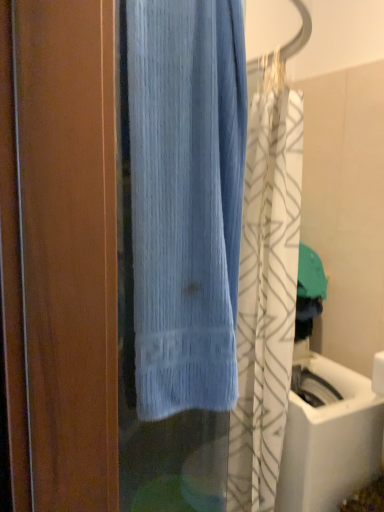
What is the approximate height of white glossy sink at lower right?

white glossy sink at lower right is 92.31 centimeters tall.

Measure the distance between point (184, 102) and camera.

The depth of point (184, 102) is 30.39 inches.

What is the approximate width of light blue textured towel at center?

The width of light blue textured towel at center is 9.54 inches.

What is the approximate height of light blue textured towel at center?

1.90 meters.

You are a GUI agent. You are given a task and a screenshot of the screen. Output one action in this format:
    pyautogui.click(x=<x>, y=<y>)
    Task: Click on the white glossy sink at lower right
    This screenshot has width=384, height=512.
    Given the screenshot: What is the action you would take?
    pyautogui.click(x=328, y=436)

Is light blue fabric at center inside the boundaries of white glossy sink at lower right, or outside?

light blue fabric at center is located beyond the bounds of white glossy sink at lower right.

Between light blue fabric at center and white glossy sink at lower right, which one has larger size?

white glossy sink at lower right is bigger.

How much distance is there between light blue fabric at center and white glossy sink at lower right?

light blue fabric at center and white glossy sink at lower right are 38.00 inches apart.

The width and height of the screenshot is (384, 512). What are the coordinates of `curtain in front of the white glossy sink at lower right` in the screenshot? It's located at (186, 199).

Which point is more forward, [336,394] or [184,258]?

Positioned in front is point [184,258].

Is the position of white glossy sink at lower right more distant than that of light blue fabric at center?

Yes, it is.

Does white glossy sink at lower right have a lesser width compared to light blue fabric at center?

No, white glossy sink at lower right is not thinner than light blue fabric at center.

What's the angular difference between white glossy sink at lower right and light blue fabric at center's facing directions?

white glossy sink at lower right and light blue fabric at center are facing 7.71 degrees away from each other.

Is light blue textured towel at center thinner than white glossy sink at lower right?

Yes.

Which is behind, point (270, 126) or point (321, 486)?

Point (321, 486)

Can we say light blue textured towel at center lies outside white glossy sink at lower right?

light blue textured towel at center is positioned outside white glossy sink at lower right.

Would you consider light blue textured towel at center to be distant from white glossy sink at lower right?

light blue textured towel at center is near white glossy sink at lower right, not far away.

Can you confirm if white glossy sink at lower right is thinner than light blue textured towel at center?

Incorrect, the width of white glossy sink at lower right is not less than that of light blue textured towel at center.

Is white glossy sink at lower right directly adjacent to light blue textured towel at center?

Answer: There is a gap between white glossy sink at lower right and light blue textured towel at center.

From a real-world perspective, is white glossy sink at lower right physically below light blue textured towel at center?

Yes, from a real-world perspective, white glossy sink at lower right is beneath light blue textured towel at center.

Who is smaller, white glossy sink at lower right or light blue textured towel at center?

white glossy sink at lower right.

Which is less distant, (x=268, y=294) or (x=164, y=383)?

The point (x=164, y=383) is closer.

From the image's perspective, which one is positioned higher, light blue textured towel at center or light blue fabric at center?

light blue fabric at center, from the image's perspective.

Locate an element on the screen. curtain that is above the light blue textured towel at center (from a real-world perspective) is located at coordinates (186, 199).

Can you confirm if light blue textured towel at center is positioned to the right of light blue fabric at center?

Indeed, light blue textured towel at center is positioned on the right side of light blue fabric at center.

Locate an element on the screen. shower curtain behind the light blue fabric at center is located at coordinates (266, 285).

Looking at this image, is light blue fabric at center taller or shorter than light blue textured towel at center?

In the image, light blue fabric at center appears to be shorter than light blue textured towel at center.

Is light blue fabric at center smaller than light blue textured towel at center?

Yes.

Identify the location of curtain above the white glossy sink at lower right (from a real-world perspective). The image size is (384, 512). (186, 199).

Locate an element on the screen. This screenshot has width=384, height=512. sink on the right of light blue fabric at center is located at coordinates (328, 436).

From the image, which object appears to be farther from white glossy sink at lower right, light blue textured towel at center or light blue fabric at center?

light blue fabric at center.

Estimate the real-world distances between objects in this image. Which object is further from light blue fabric at center, white glossy sink at lower right or light blue textured towel at center?

Based on the image, white glossy sink at lower right appears to be further to light blue fabric at center.

When comparing their distances from white glossy sink at lower right, does light blue fabric at center or light blue textured towel at center seem closer?

The object closer to white glossy sink at lower right is light blue textured towel at center.

Looking at the image, which one is located closer to light blue textured towel at center, white glossy sink at lower right or light blue fabric at center?

white glossy sink at lower right is closer to light blue textured towel at center.

Looking at the image, which one is located closer to light blue textured towel at center, light blue fabric at center or white glossy sink at lower right?

The object closer to light blue textured towel at center is white glossy sink at lower right.

Estimate the real-world distances between objects in this image. Which object is closer to light blue fabric at center, light blue textured towel at center or white glossy sink at lower right?

light blue textured towel at center is positioned closer to the anchor light blue fabric at center.

This screenshot has width=384, height=512. In order to click on shower curtain between light blue fabric at center and white glossy sink at lower right in the up-down direction in this screenshot , I will do pyautogui.click(x=266, y=285).